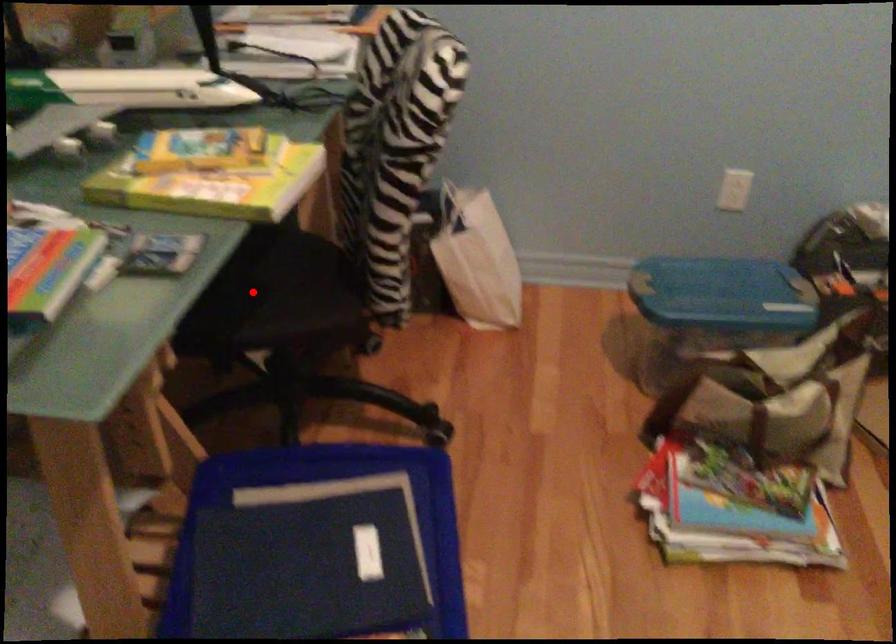
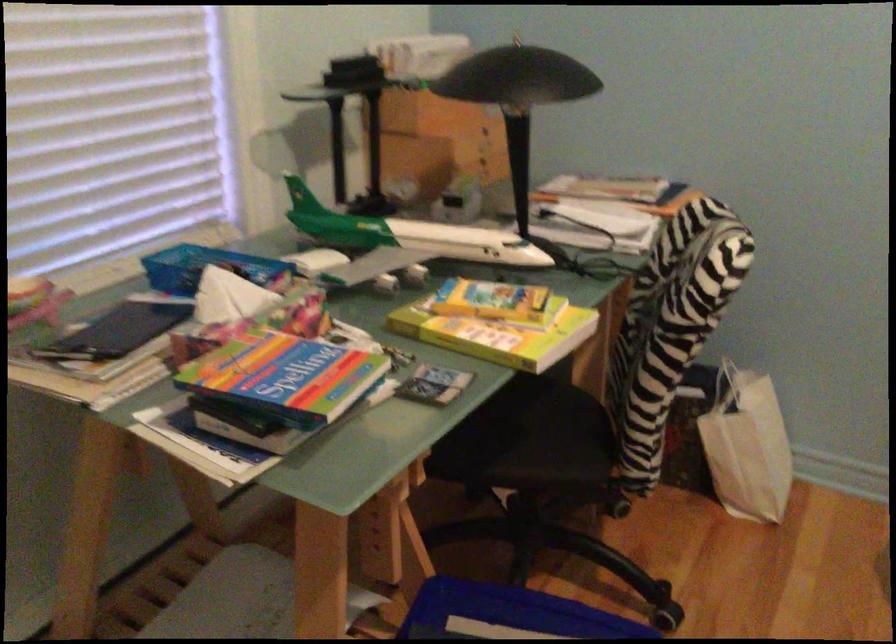
Find the pixel in the second image that matches the highlighted location in the first image.

(510, 430)